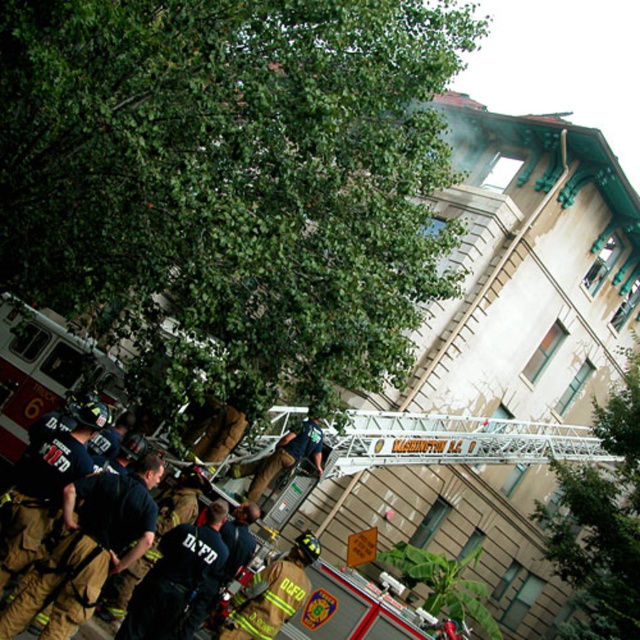
Which is in front, point (481, 483) or point (246, 493)?

Positioned in front is point (246, 493).

Can you confirm if red and white fire truck at lower left is positioned to the left of reflective silver helmet at center?

No, red and white fire truck at lower left is not to the left of reflective silver helmet at center.

Where is `red and white fire truck at lower left`? The image size is (640, 640). red and white fire truck at lower left is located at coordinates (442, 499).

Identify the location of brown/canvas fireman at center. This screenshot has height=640, width=640. (272, 593).

Who is positioned more to the right, brown/canvas fireman at center or reflective silver helmet at center?

From the viewer's perspective, brown/canvas fireman at center appears more on the right side.

Who is more distant from viewer, (234, 602) or (288, 464)?

Positioned behind is point (288, 464).

The image size is (640, 640). I want to click on brown/canvas fireman at center, so click(x=272, y=593).

Does red and white fire truck at lower left have a lesser height compared to brown/canvas fireman at center?

No, red and white fire truck at lower left is not shorter than brown/canvas fireman at center.

Consider the image. Is red and white fire truck at lower left behind brown/canvas fireman at center?

Yes, it is behind brown/canvas fireman at center.

Which is behind, point (541, 385) or point (250, 589)?

Point (541, 385)

Where is `red and white fire truck at lower left`? red and white fire truck at lower left is located at coordinates (442, 499).